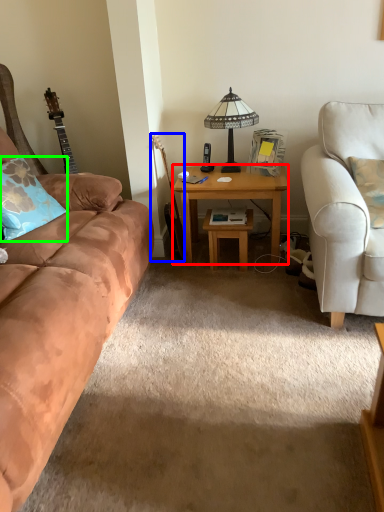
Question: Which object is the farthest from desk (highlighted by a red box)? Choose among these: guitar (highlighted by a blue box) or pillow (highlighted by a green box).

Choices:
 (A) guitar
 (B) pillow

Answer: (B)